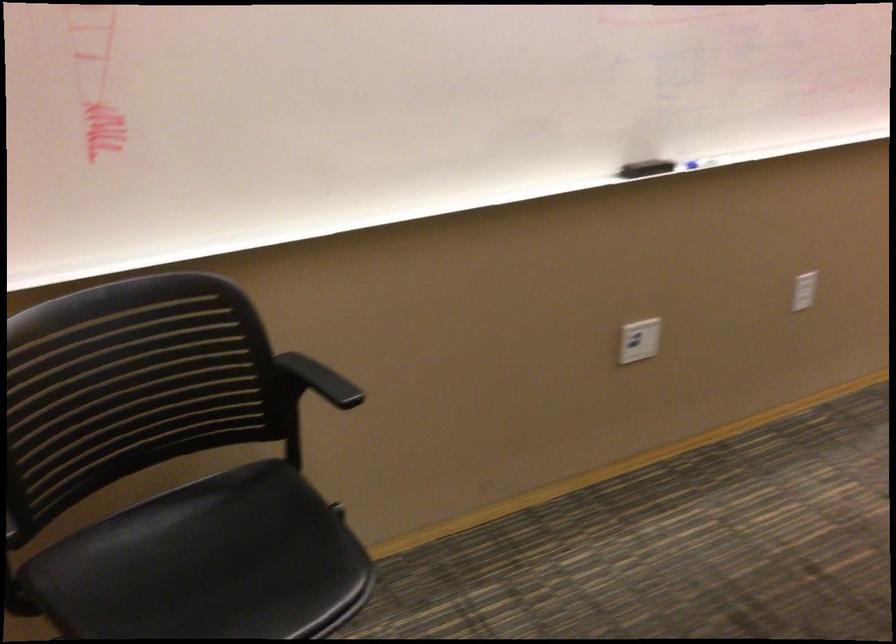
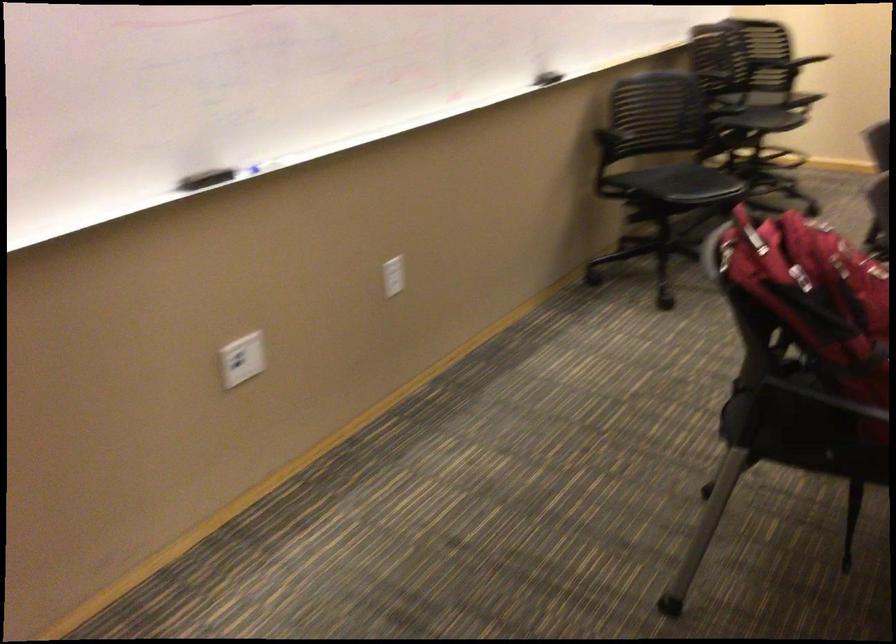
Which direction would the cameraman need to move to produce the second image?

The cameraman walked toward right, forward.